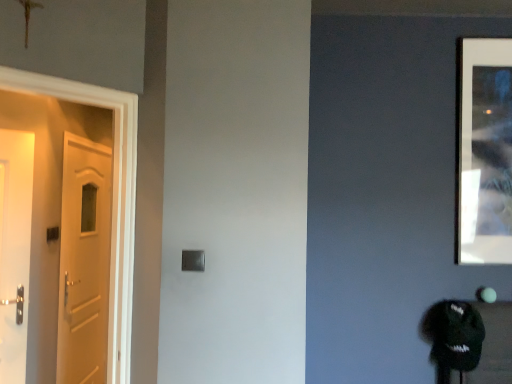
Question: Does metallic silver frame at upper right turn towards white glossy door at left?

Choices:
 (A) yes
 (B) no

Answer: (B)

Question: Does metallic silver frame at upper right have a greater width compared to white glossy door at left?

Choices:
 (A) no
 (B) yes

Answer: (A)

Question: Is metallic silver frame at upper right surrounding white glossy door at left?

Choices:
 (A) no
 (B) yes

Answer: (A)

Question: Can you confirm if metallic silver frame at upper right is positioned to the left of white glossy door at left?

Choices:
 (A) yes
 (B) no

Answer: (B)

Question: Is metallic silver frame at upper right taller than white glossy door at left?

Choices:
 (A) yes
 (B) no

Answer: (B)

Question: Can you confirm if metallic silver frame at upper right is positioned to the right of white glossy door at left?

Choices:
 (A) yes
 (B) no

Answer: (A)

Question: Considering the relative sizes of white glossy door at left and metallic silver frame at upper right in the image provided, is white glossy door at left taller than metallic silver frame at upper right?

Choices:
 (A) yes
 (B) no

Answer: (A)

Question: Is white glossy door at left facing towards metallic silver frame at upper right?

Choices:
 (A) no
 (B) yes

Answer: (A)

Question: From the image's perspective, is white glossy door at left under metallic silver frame at upper right?

Choices:
 (A) no
 (B) yes

Answer: (B)

Question: Does white glossy door at left have a greater width compared to metallic silver frame at upper right?

Choices:
 (A) yes
 (B) no

Answer: (A)

Question: From the image's perspective, is white glossy door at left on metallic silver frame at upper right?

Choices:
 (A) yes
 (B) no

Answer: (B)

Question: Could metallic silver frame at upper right be considered to be inside white glossy door at left?

Choices:
 (A) yes
 (B) no

Answer: (B)

Question: In terms of height, does metallic silver frame at upper right look taller or shorter compared to white glossy door at left?

Choices:
 (A) short
 (B) tall

Answer: (A)